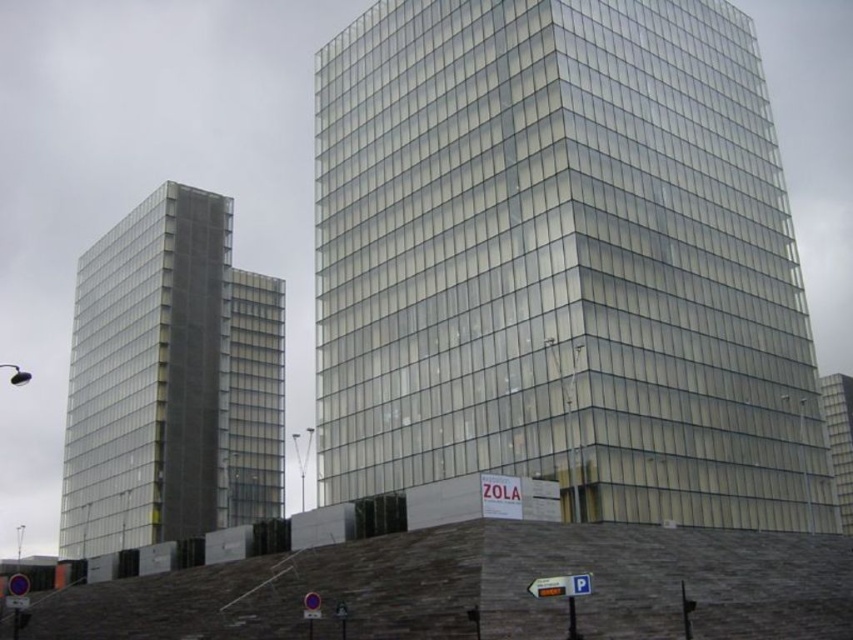
Is transparent glass building at center to the left of transparent glass building at right from the viewer's perspective?

Yes, transparent glass building at center is to the left of transparent glass building at right.

Who is positioned more to the right, transparent glass building at center or transparent glass building at right?

transparent glass building at right

Between point (433, 3) and point (850, 532), which one is positioned behind?

Point (850, 532)

The image size is (853, 640). In order to click on transparent glass building at center in this screenshot , I will do `click(561, 262)`.

Is transparent glass tower at left above transparent glass building at right?

Yes.

From the picture: Does transparent glass tower at left appear on the left side of transparent glass building at right?

Correct, you'll find transparent glass tower at left to the left of transparent glass building at right.

Who is more forward, (234, 376) or (850, 490)?

Point (234, 376) is more forward.

In order to click on transparent glass tower at left in this screenshot , I will do `click(171, 381)`.

Is transparent glass building at center bigger than transparent glass tower at left?

No, transparent glass building at center is not bigger than transparent glass tower at left.

Does transparent glass building at center have a lesser width compared to transparent glass tower at left?

No, transparent glass building at center is not thinner than transparent glass tower at left.

Is point (607, 508) positioned before point (132, 236)?

Yes, point (607, 508) is closer to viewer.

At what (x,y) coordinates should I click in order to perform the action: click on transparent glass building at center. Please return your answer as a coordinate pair (x, y). Image resolution: width=853 pixels, height=640 pixels. Looking at the image, I should click on (561, 262).